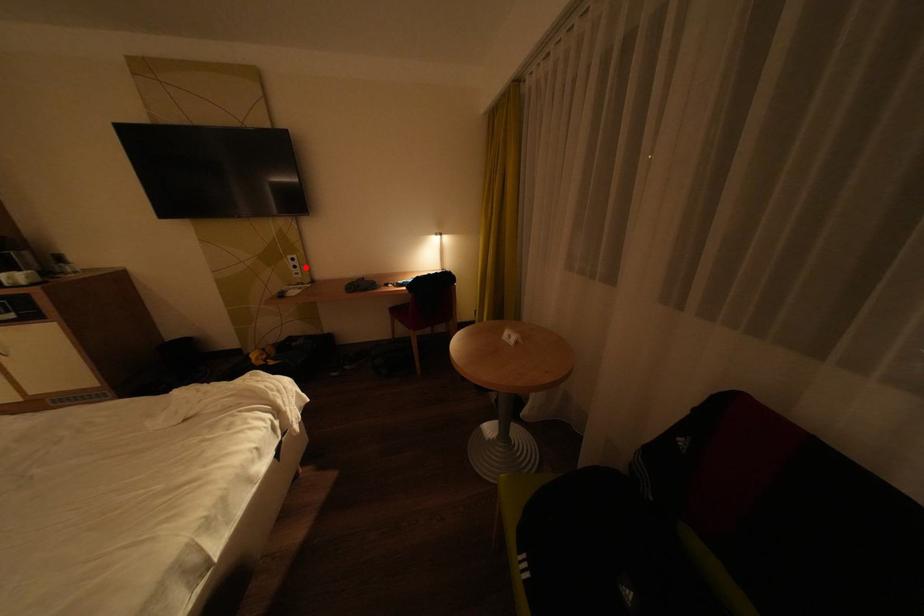
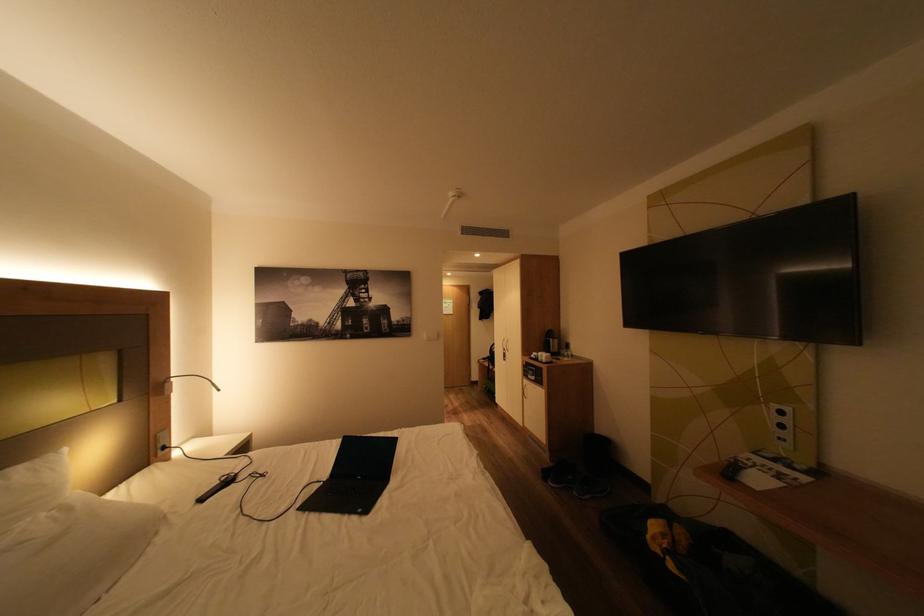
Question: A red point is marked in image1. In image2, is the corresponding 3D point closer to the camera or farther? Reply with the corresponding letter.

Choices:
 (A) The corresponding 3D point is closer.
 (B) The corresponding 3D point is farther.

Answer: (B)